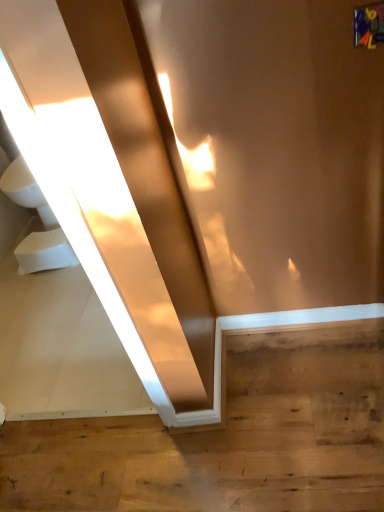
Measure the distance between point (5, 173) and camera.

The distance of point (5, 173) from camera is 2.47 meters.

The image size is (384, 512). What do you see at coordinates (41, 220) in the screenshot?
I see `white glossy sink at left` at bounding box center [41, 220].

Measure the distance between point (33, 270) and camera.

A distance of 7.93 feet exists between point (33, 270) and camera.

Find the location of a particular element. The height and width of the screenshot is (512, 384). wooden floor at lower right is located at coordinates (226, 437).

Which is in front, wooden floor at lower right or white glossy sink at left?

wooden floor at lower right is in front.

Does wooden floor at lower right turn towards white glossy sink at left?

No, wooden floor at lower right is not facing towards white glossy sink at left.

Is white glossy sink at left a part of wooden floor at lower right?

Definitely not — white glossy sink at left is not inside wooden floor at lower right.

Does wooden floor at lower right touch white glossy sink at left?

wooden floor at lower right and white glossy sink at left are not in contact.

Is white foam toilet bowl at lower left oriented away from white glossy sink at left?

That's right, white foam toilet bowl at lower left is facing away from white glossy sink at left.

Looking at this image, which is farther, (68, 245) or (20, 245)?

The point (20, 245) is farther.

Which of these two, white foam toilet bowl at lower left or white glossy sink at left, is bigger?

Bigger between the two is white glossy sink at left.

Is white foam toilet bowl at lower left oriented away from wooden floor at lower right?

No, white foam toilet bowl at lower left's orientation is not away from wooden floor at lower right.

You are a GUI agent. You are given a task and a screenshot of the screen. Output one action in this format:
    pyautogui.click(x=<x>, y=<y>)
    Task: Click on the toilet bowl behind the wooden floor at lower right
    This screenshot has height=512, width=384.
    Given the screenshot: What is the action you would take?
    pyautogui.click(x=45, y=252)

Does white foam toilet bowl at lower left have a larger size compared to wooden floor at lower right?

Actually, white foam toilet bowl at lower left might be smaller than wooden floor at lower right.

Does white foam toilet bowl at lower left have a lesser width compared to wooden floor at lower right?

Yes.

From a real-world perspective, between white glossy sink at left and wooden floor at lower right, who is vertically lower?

wooden floor at lower right, from a real-world perspective.

Can you tell me how much white glossy sink at left and wooden floor at lower right differ in facing direction?

The angle between the facing direction of white glossy sink at left and the facing direction of wooden floor at lower right is 89 degrees.

Is white glossy sink at left positioned with its back to wooden floor at lower right?

No, white glossy sink at left is not facing away from wooden floor at lower right.

Is white glossy sink at left to the right of wooden floor at lower right from the viewer's perspective?

No, white glossy sink at left is not to the right of wooden floor at lower right.

In order to click on sink on the left of white foam toilet bowl at lower left in this screenshot , I will do `click(41, 220)`.

From the image's perspective, is white glossy sink at left above white foam toilet bowl at lower left?

Correct, white glossy sink at left appears higher than white foam toilet bowl at lower left in the image.

Consider the image. Which is closer to the camera, (38, 248) or (23, 265)?

Point (38, 248).

Based on the photo, would you say wooden floor at lower right is a long distance from white foam toilet bowl at lower left?

Yes.

Which point is more forward, (38, 469) or (48, 239)?

The point (38, 469) is closer.

The image size is (384, 512). What are the coordinates of `toilet bowl that is above the wooden floor at lower right (from a real-world perspective)` in the screenshot? It's located at (45, 252).

How different are the orientations of wooden floor at lower right and white foam toilet bowl at lower left in degrees?

80.5 degrees.

Find the location of a particular element. stairwell on the right of white glossy sink at left is located at coordinates (226, 437).

Where is `sink above the white foam toilet bowl at lower left (from the image's perspective)`? This screenshot has width=384, height=512. sink above the white foam toilet bowl at lower left (from the image's perspective) is located at coordinates (41, 220).

Which object lies further to the anchor point white glossy sink at left, white foam toilet bowl at lower left or wooden floor at lower right?

Based on the image, wooden floor at lower right appears to be further to white glossy sink at left.

When comparing their distances from white foam toilet bowl at lower left, does white glossy sink at left or wooden floor at lower right seem closer?

white glossy sink at left.

Considering their positions, is wooden floor at lower right positioned closer to white foam toilet bowl at lower left than white glossy sink at left?

The object closer to white foam toilet bowl at lower left is white glossy sink at left.

Looking at the image, which one is located closer to wooden floor at lower right, white glossy sink at left or white foam toilet bowl at lower left?

Among the two, white foam toilet bowl at lower left is located nearer to wooden floor at lower right.

Estimate the real-world distances between objects in this image. Which object is further from wooden floor at lower right, white foam toilet bowl at lower left or white glossy sink at left?

Among the two, white glossy sink at left is located further to wooden floor at lower right.

Looking at the image, which one is located further to white glossy sink at left, wooden floor at lower right or white foam toilet bowl at lower left?

wooden floor at lower right is further to white glossy sink at left.

The height and width of the screenshot is (512, 384). I want to click on toilet bowl located between wooden floor at lower right and white glossy sink at left in the depth direction, so click(x=45, y=252).